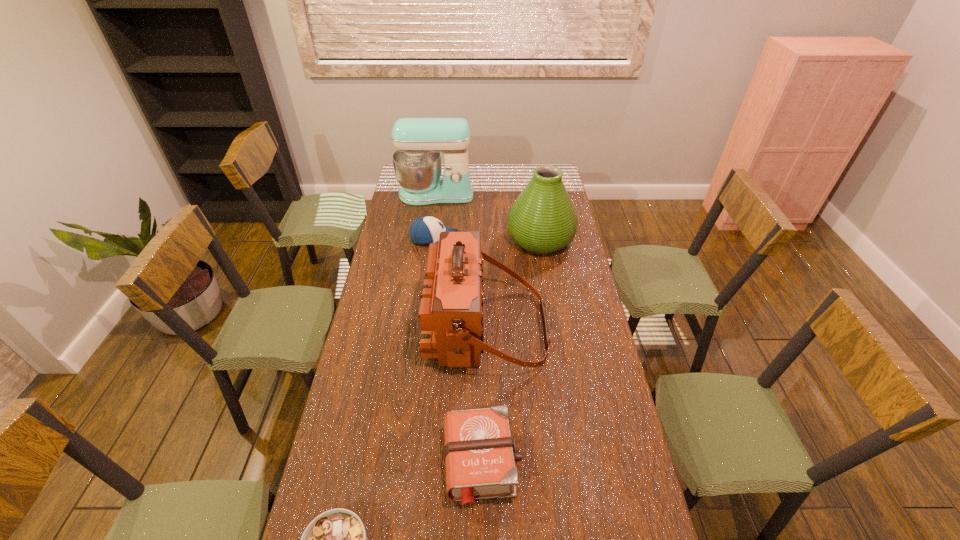
Find the location of a particular element. Image resolution: width=960 pixels, height=540 pixels. vacant space in between the vase and the third shortest object is located at coordinates (488, 239).

Identify the location of empty space between the vase and the Bible. (512, 350).

The width and height of the screenshot is (960, 540). Find the location of `empty location between the third nearest object and the vase`. empty location between the third nearest object and the vase is located at coordinates (513, 283).

Locate an element on the screen. This screenshot has width=960, height=540. unoccupied area between the satchel and the vase is located at coordinates (513, 283).

This screenshot has width=960, height=540. Identify the location of the closest object to the mixer. (542, 220).

Select which object appears as the fifth closest to the soup bowl. Please provide its 2D coordinates. Your answer should be formatted as a tuple, i.e. [(x, y)], where the tuple contains the x and y coordinates of a point satisfying the conditions above.

[(419, 142)]

At what (x,y) coordinates should I click in order to perform the action: click on free point that satisfies the following two spatial constraints: 1. at the base of the fifth farthest object; 2. on the right side of the mixer. Please return your answer as a coordinate pair (x, y). Looking at the image, I should click on (399, 462).

The height and width of the screenshot is (540, 960). I want to click on free space that satisfies the following two spatial constraints: 1. at the base of the mixer; 2. on the left side of the vase, so click(430, 239).